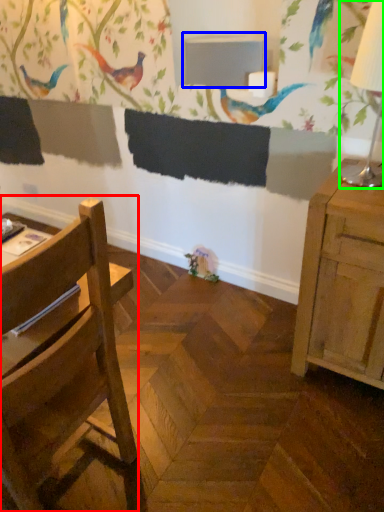
Question: Based on their relative distances, which object is farther from chair (highlighted by a red box)? Choose from table (highlighted by a blue box) and table lamp (highlighted by a green box).

Choices:
 (A) table
 (B) table lamp

Answer: (A)